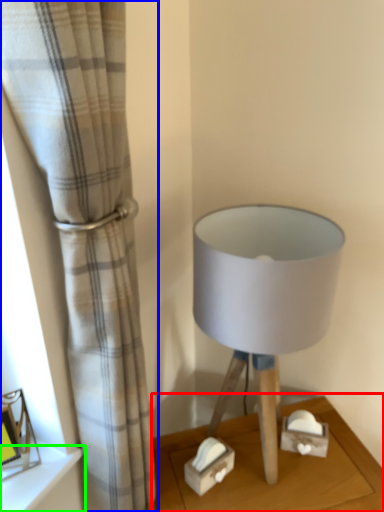
Question: Considering the real-world distances, which object is farthest from table (highlighted by a red box)? curtain (highlighted by a blue box) or shelf (highlighted by a green box)?

Choices:
 (A) curtain
 (B) shelf

Answer: (A)